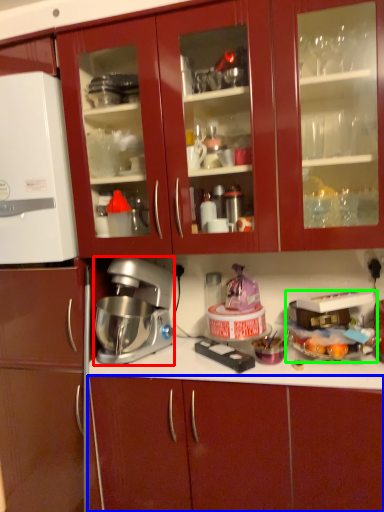
Question: Based on their relative distances, which object is nearer to mixer (highlighted by a red box)? Choose from cabinetry (highlighted by a blue box) and appliance (highlighted by a green box).

Choices:
 (A) cabinetry
 (B) appliance

Answer: (A)